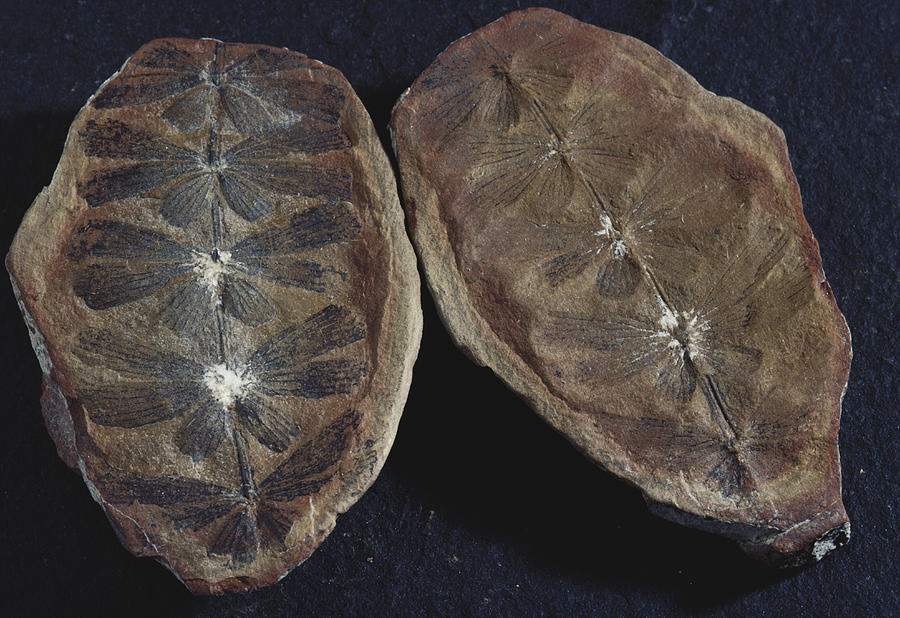
The height and width of the screenshot is (618, 900). What are the coordinates of `floor` in the screenshot? It's located at (475, 528).